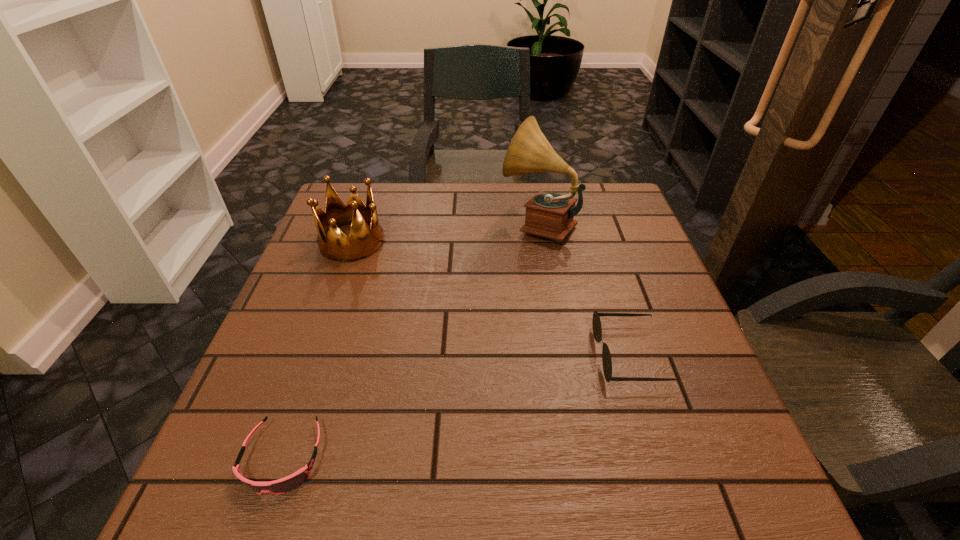
This screenshot has width=960, height=540. What are the coordinates of `vacant space situated on the front-facing side of the sunglasses` in the screenshot? It's located at [540, 355].

In order to click on free space located 0.080m on the front-facing side of the sunglasses in this screenshot , I will do `click(557, 355)`.

The width and height of the screenshot is (960, 540). I want to click on free space located 0.390m on the front-facing side of the sunglasses, so click(396, 355).

The height and width of the screenshot is (540, 960). Find the location of `phonograph record positioned at the far edge`. phonograph record positioned at the far edge is located at coordinates (550, 215).

This screenshot has width=960, height=540. Identify the location of crown that is at the far edge. (334, 244).

Locate an element on the screen. This screenshot has width=960, height=540. object situated at the near edge is located at coordinates pyautogui.click(x=286, y=484).

I want to click on crown at the left edge, so click(x=334, y=244).

Find the location of a particular element. This screenshot has width=960, height=540. goggles present at the left edge is located at coordinates (286, 484).

Image resolution: width=960 pixels, height=540 pixels. I want to click on object present at the right edge, so (x=596, y=322).

The height and width of the screenshot is (540, 960). In order to click on object present at the far left corner in this screenshot , I will do `click(334, 244)`.